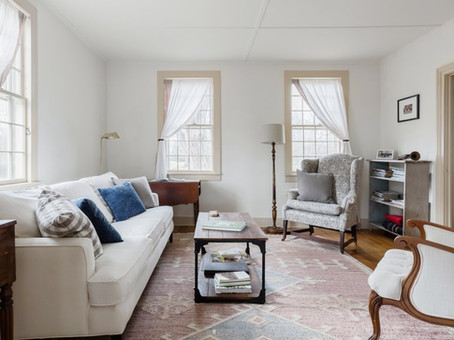
Locate an element on the screen. The width and height of the screenshot is (454, 340). white chair is located at coordinates (395, 261).